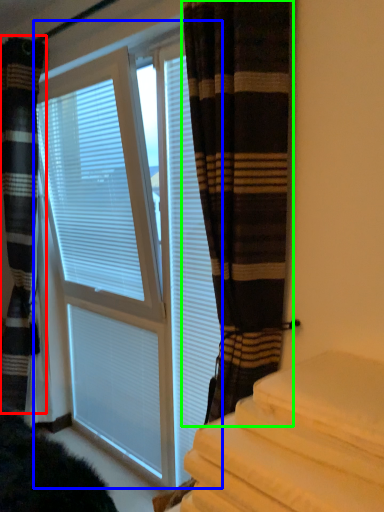
Question: Based on their relative distances, which object is nearer to curtain (highlighted by a red box)? Choose from bay window (highlighted by a blue box) and curtain (highlighted by a green box).

Choices:
 (A) bay window
 (B) curtain

Answer: (A)